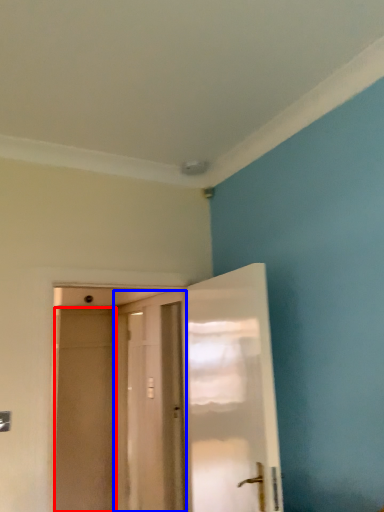
Question: Among these objects, which one is farthest to the camera, screen door (highlighted by a red box) or door (highlighted by a blue box)?

Choices:
 (A) screen door
 (B) door

Answer: (A)